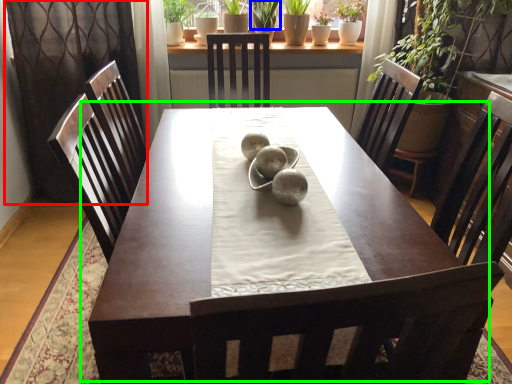
Question: Estimate the real-world distances between objects in this image. Which object is closer to curtain (highlighted by a red box), plant (highlighted by a blue box) or table (highlighted by a green box)?

Choices:
 (A) plant
 (B) table

Answer: (B)